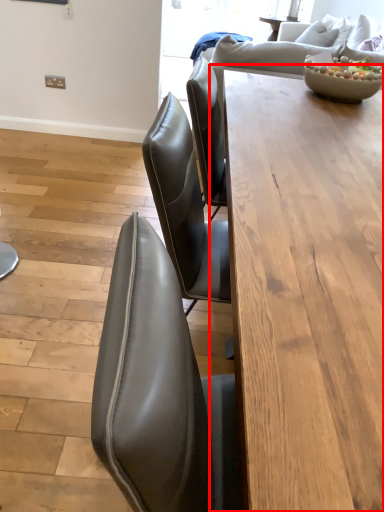
Question: Where is table (annotated by the red box) located in relation to bowl in the image?

Choices:
 (A) left
 (B) right

Answer: (A)